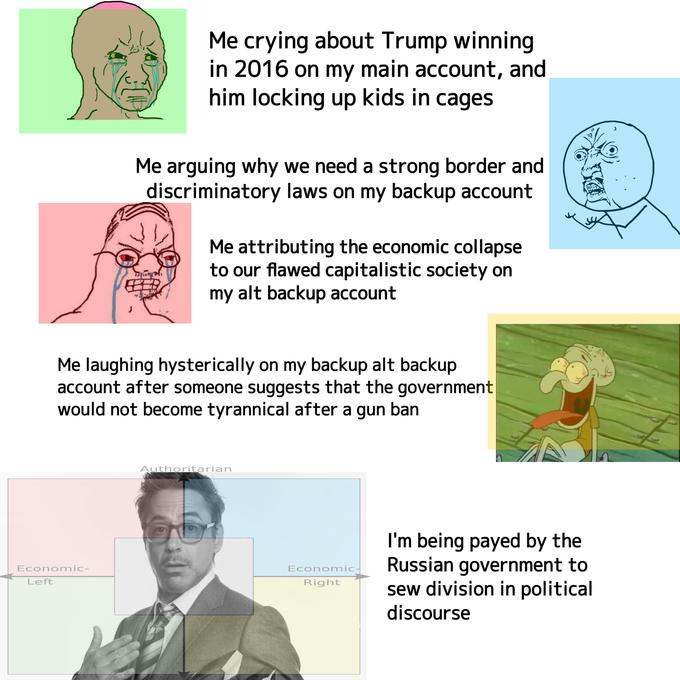
This screenshot has width=680, height=680. I want to click on pictures, so click(x=99, y=86), click(x=619, y=207), click(x=109, y=270), click(x=517, y=381), click(x=204, y=608).